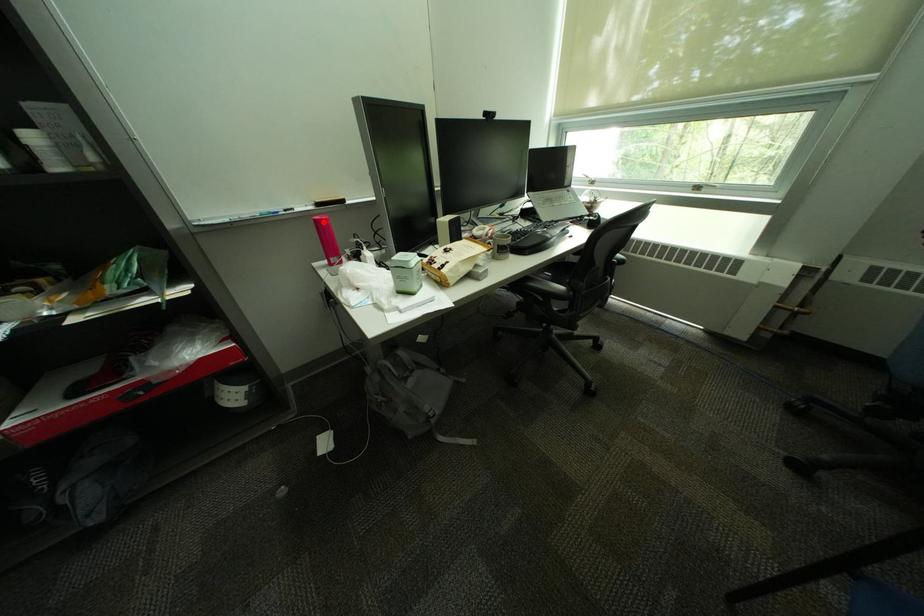
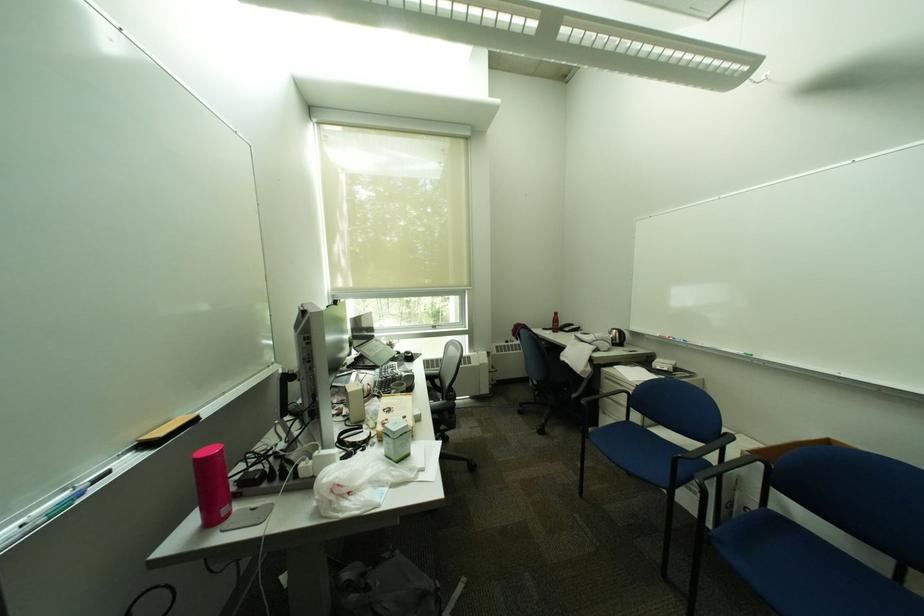
Question: I am providing you with two images of the same scene from different viewpoints. In image1, a red point is highlighted. Considering the same 3D point in image2, which of the following is correct?

Choices:
 (A) It is closer
 (B) It is farther

Answer: (B)